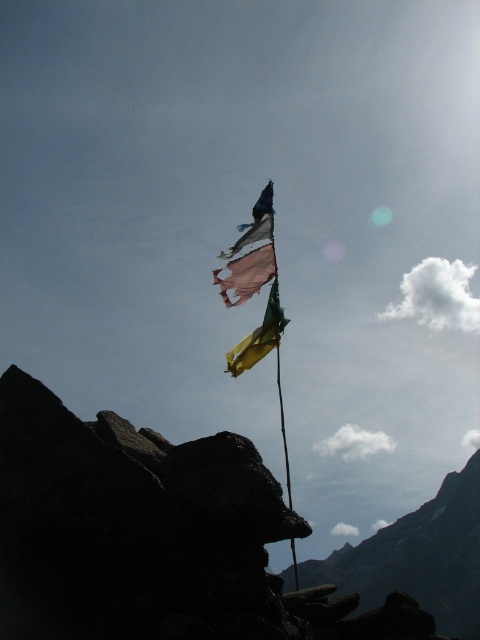
You are standing at the point with coordinates point (239, 282) and want to walk to the point with coordinates point (463, 480). Is there any obstruction between you and your destination?

Point (463, 480) is behind point (239, 282), so there is an obstruction between them.